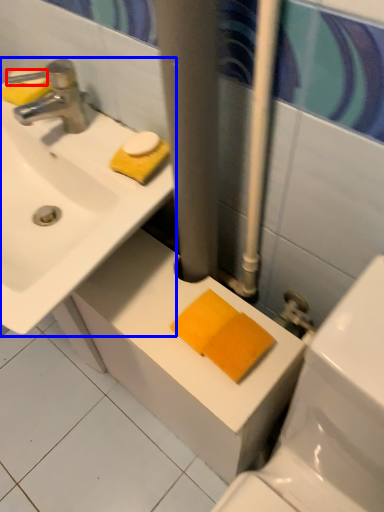
Question: Which object appears farthest to the camera in this image, soap (highlighted by a red box) or sink (highlighted by a blue box)?

Choices:
 (A) soap
 (B) sink

Answer: (A)